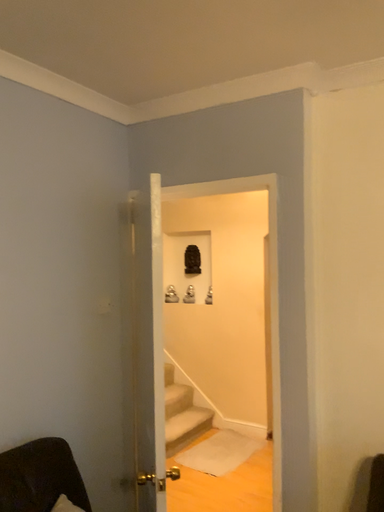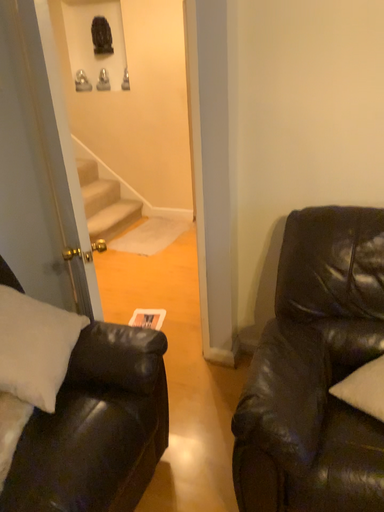
Question: Which way did the camera rotate in the video?

Choices:
 (A) rotated upward
 (B) rotated downward

Answer: (B)